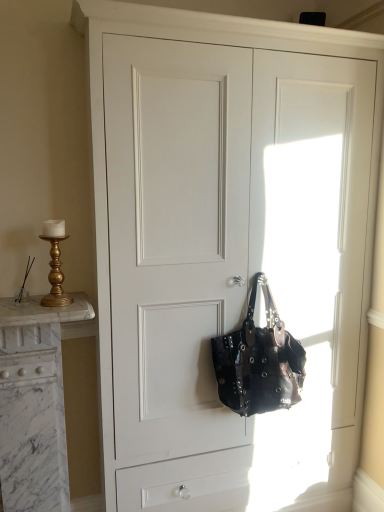
Question: Considering the positions of gold metallic candlestick at left and shiny black leather handbag at center in the image, is gold metallic candlestick at left taller or shorter than shiny black leather handbag at center?

Choices:
 (A) tall
 (B) short

Answer: (B)

Question: Is point 48,294 closer or farther from the camera than point 213,353?

Choices:
 (A) farther
 (B) closer

Answer: (B)

Question: Relative to shiny black leather handbag at center, is gold metallic candlestick at left in front or behind?

Choices:
 (A) behind
 (B) front

Answer: (B)

Question: Relative to gold metallic candlestick at left, is shiny black leather handbag at center in front or behind?

Choices:
 (A) behind
 (B) front

Answer: (A)

Question: Is shiny black leather handbag at center bigger or smaller than gold metallic candlestick at left?

Choices:
 (A) big
 (B) small

Answer: (A)

Question: In terms of height, does shiny black leather handbag at center look taller or shorter compared to gold metallic candlestick at left?

Choices:
 (A) short
 (B) tall

Answer: (B)

Question: From the image's perspective, is shiny black leather handbag at center positioned above or below gold metallic candlestick at left?

Choices:
 (A) below
 (B) above

Answer: (A)